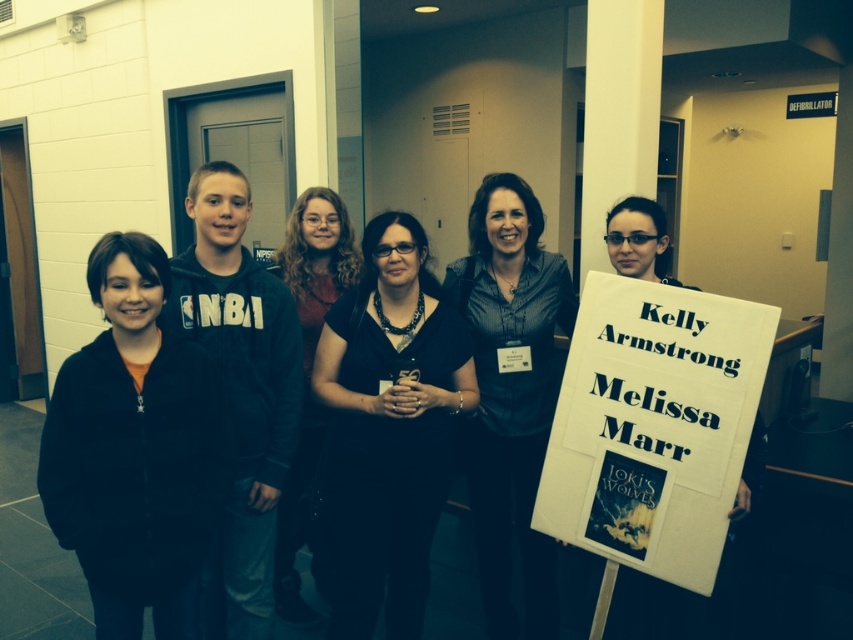
Is black matte dress at center closer to the viewer compared to dark blue shirt at center?

Yes, it is.

Between black matte dress at center and dark blue shirt at center, which one is positioned higher?

dark blue shirt at center is higher up.

Where is `black matte dress at center`? The height and width of the screenshot is (640, 853). black matte dress at center is located at coordinates (387, 429).

The image size is (853, 640). Find the location of `black matte dress at center`. black matte dress at center is located at coordinates (387, 429).

What do you see at coordinates (387, 429) in the screenshot? The height and width of the screenshot is (640, 853). I see `black matte dress at center` at bounding box center [387, 429].

Is the position of black matte dress at center more distant than that of dark brown hair at center?

No, it is in front of dark brown hair at center.

What do you see at coordinates (387, 429) in the screenshot?
I see `black matte dress at center` at bounding box center [387, 429].

The height and width of the screenshot is (640, 853). What are the coordinates of `black matte dress at center` in the screenshot? It's located at (387, 429).

Is matte black jacket at center thinner than dark brown hair at center?

No, matte black jacket at center is not thinner than dark brown hair at center.

Is matte black jacket at center taller than dark brown hair at center?

Incorrect, matte black jacket at center's height is not larger of dark brown hair at center's.

Where is `matte black jacket at center`? The image size is (853, 640). matte black jacket at center is located at coordinates (134, 454).